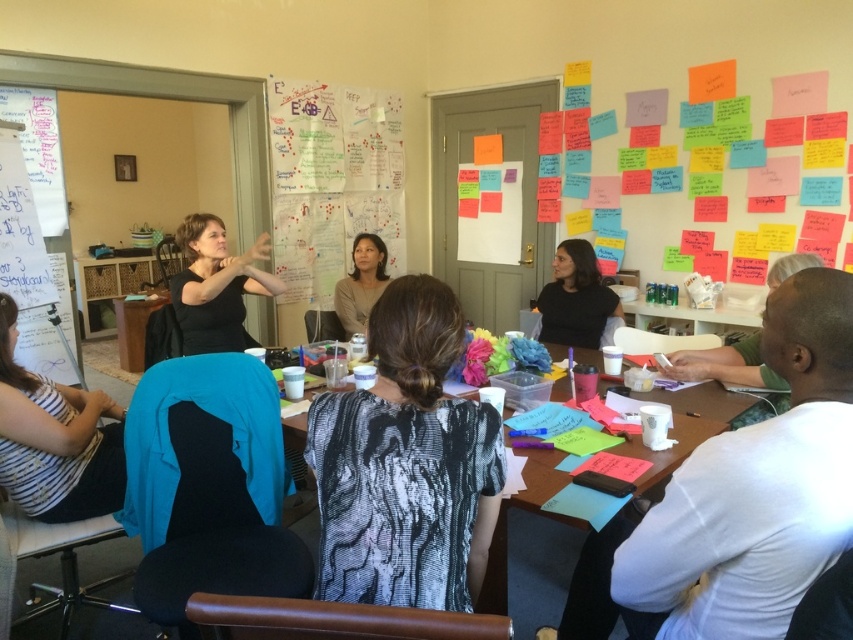
Question: Which of these objects is positioned farthest from the white striped shirt at lower left?

Choices:
 (A) matte black shirt at center
 (B) whiteboard at left

Answer: (A)

Question: Does whiteboard at left have a lesser width compared to black matte shirt at left?

Choices:
 (A) no
 (B) yes

Answer: (B)

Question: Which object is positioned closest to the wooden table at center?

Choices:
 (A) matte black shirt at center
 (B) white striped shirt at lower left

Answer: (B)

Question: Which is farther from the whiteboard at left?

Choices:
 (A) black textured blouse at center
 (B) white striped shirt at lower left
 (C) black matte shirt at left
 (D) matte black shirt at center

Answer: (A)

Question: Is wooden table at center below matte black shirt at center?

Choices:
 (A) yes
 (B) no

Answer: (A)

Question: Considering the relative positions of whiteboard at left and matte black shirt at center in the image provided, where is whiteboard at left located with respect to matte black shirt at center?

Choices:
 (A) above
 (B) below

Answer: (A)